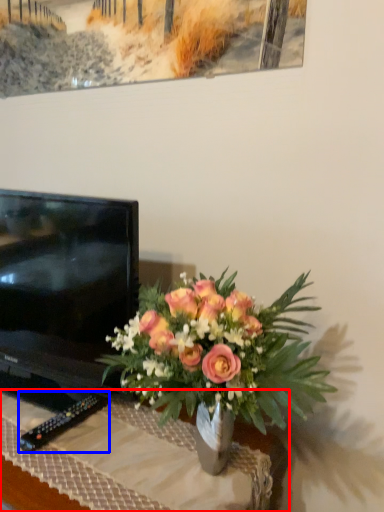
Question: Which point is further to the camera, desk (highlighted by a red box) or remote (highlighted by a blue box)?

Choices:
 (A) desk
 (B) remote

Answer: (B)